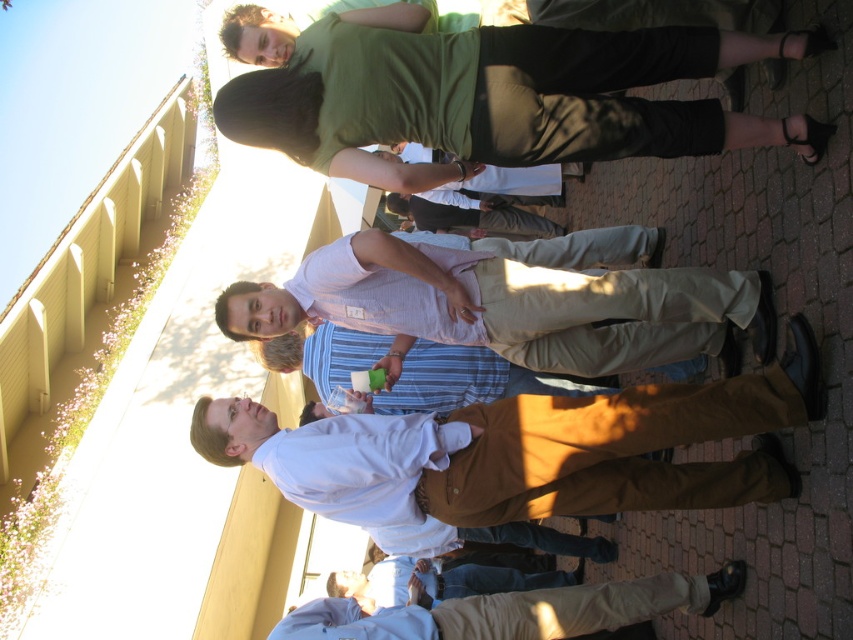
You are a photographer standing in the courtyard. You notice the green cotton shirt at upper center and the khaki cotton pants at center. Which clothing item is positioned lower in the image?

The green cotton shirt at upper center is located below the khaki cotton pants at center, so the green cotton shirt at upper center is positioned lower in the image.

You are standing in the courtyard and want to walk from point A to point B. Point A is at coordinate point (403, 586) and point B is at coordinate point (445, 220). Which point is closer to you when you start walking?

Point A at coordinate point (403, 586) is closer to you than point B at coordinate point (445, 220), so you will start at the closer point A.